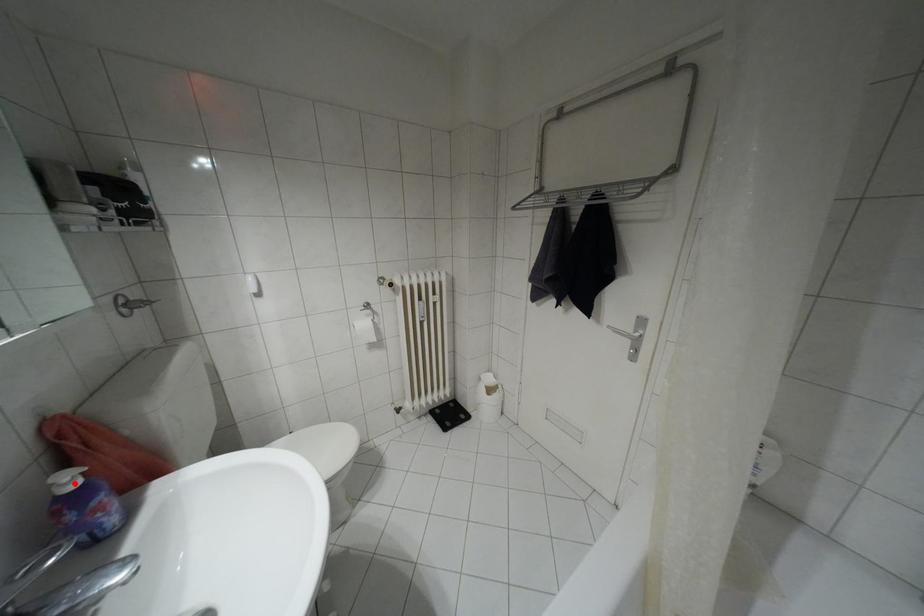
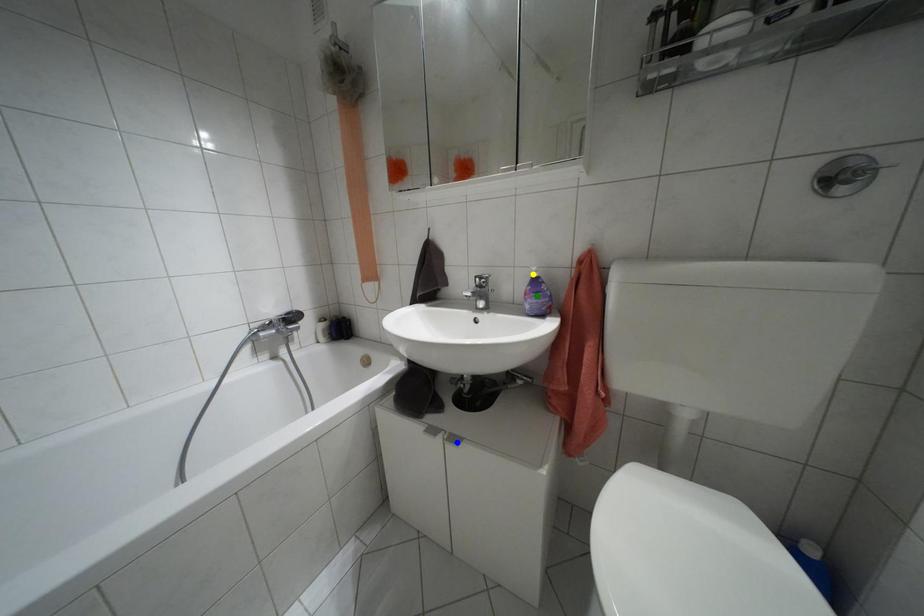
Question: I am providing you with two images of the same scene from different viewpoints. A red point is marked on the first image. You are given multiple points on the second image. Which spot in image 2 lines up with the point in image 1?

Choices:
 (A) blue point
 (B) green point
 (C) yellow point

Answer: (C)